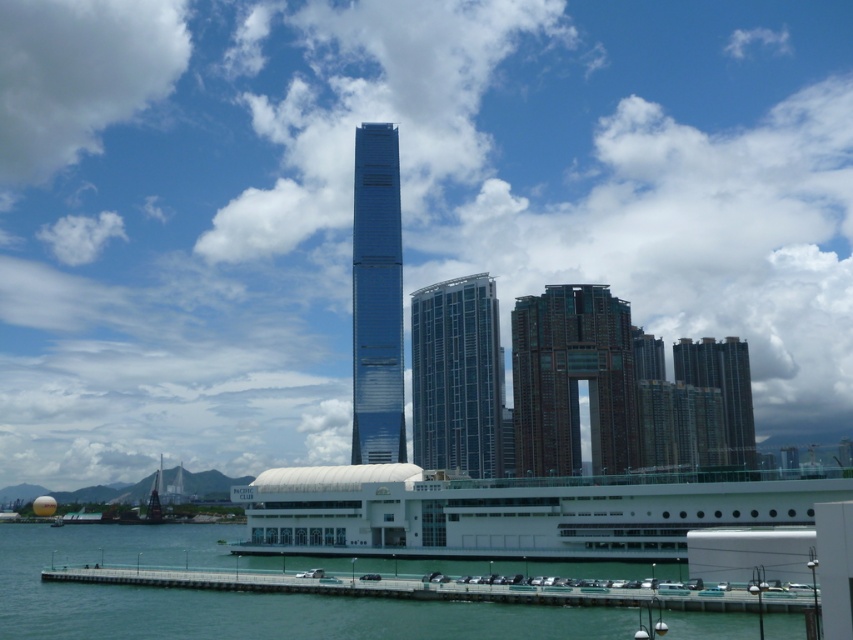
Question: Can you confirm if glossy glass tower at center is positioned to the left of dark brown glass building at right?

Choices:
 (A) no
 (B) yes

Answer: (B)

Question: Which is nearer to the glossy glass tower at center?

Choices:
 (A) brown brick building at center
 (B) dark brown glass building at right
 (C) glassy blue skyscraper at center
 (D) clear water at lower left

Answer: (C)

Question: Can you confirm if glassy blue skyscraper at center is bigger than smooth concrete dock at lower center?

Choices:
 (A) yes
 (B) no

Answer: (A)

Question: In this image, where is white fluffy cloud at upper left located relative to dark brown glass building at right?

Choices:
 (A) left
 (B) right

Answer: (A)

Question: Which point is closer to the camera?

Choices:
 (A) (527, 388)
 (B) (299, 637)
 (C) (726, 419)
 (D) (368, 212)

Answer: (B)

Question: Which of the following is the closest to the observer?

Choices:
 (A) clear water at lower left
 (B) smooth concrete dock at lower center
 (C) glossy glass tower at center

Answer: (A)